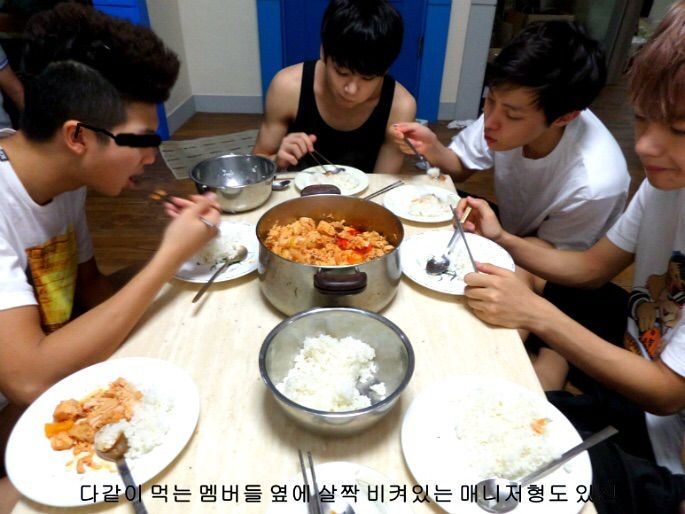
The height and width of the screenshot is (514, 685). What are the coordinates of `spoon` in the screenshot? It's located at (495, 507), (329, 507), (118, 450), (236, 254), (438, 267).